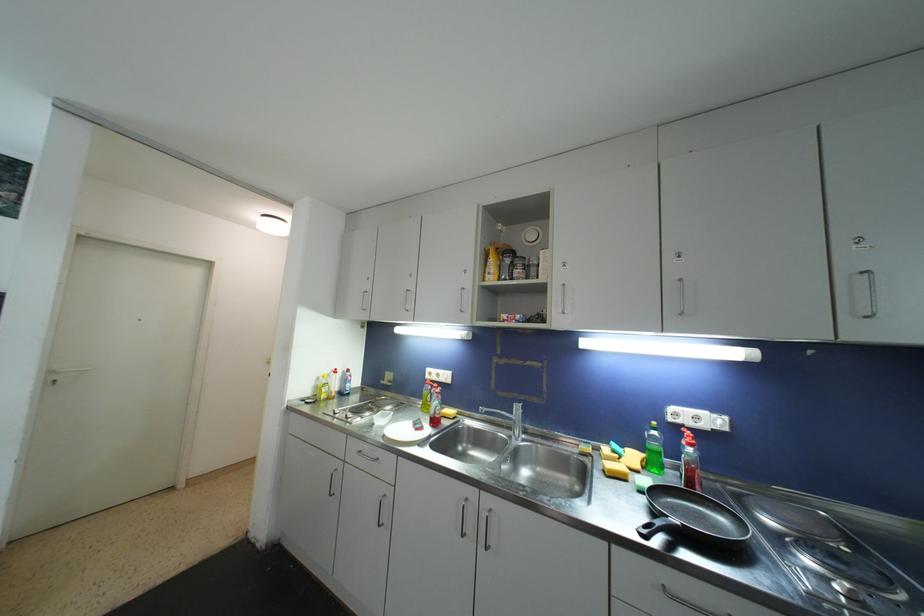
This screenshot has height=616, width=924. What do you see at coordinates (492, 264) in the screenshot?
I see `a yellow spray bottle` at bounding box center [492, 264].